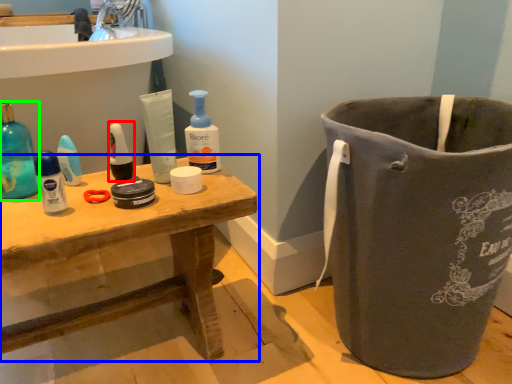
Question: Considering the real-world distances, which object is farthest from mouthwash (highlighted by a red box)? table (highlighted by a blue box) or cleaning product (highlighted by a green box)?

Choices:
 (A) table
 (B) cleaning product

Answer: (A)